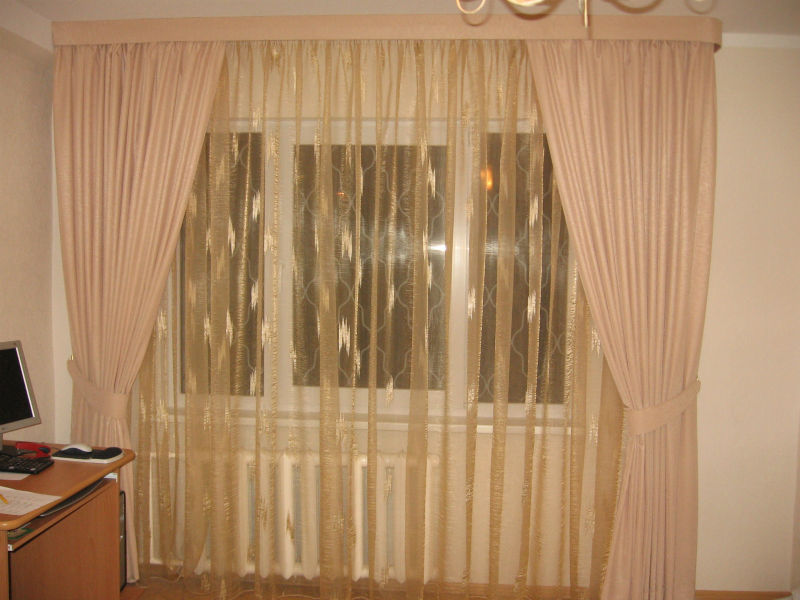
The width and height of the screenshot is (800, 600). I want to click on beige valance above drapes, so click(x=370, y=25).